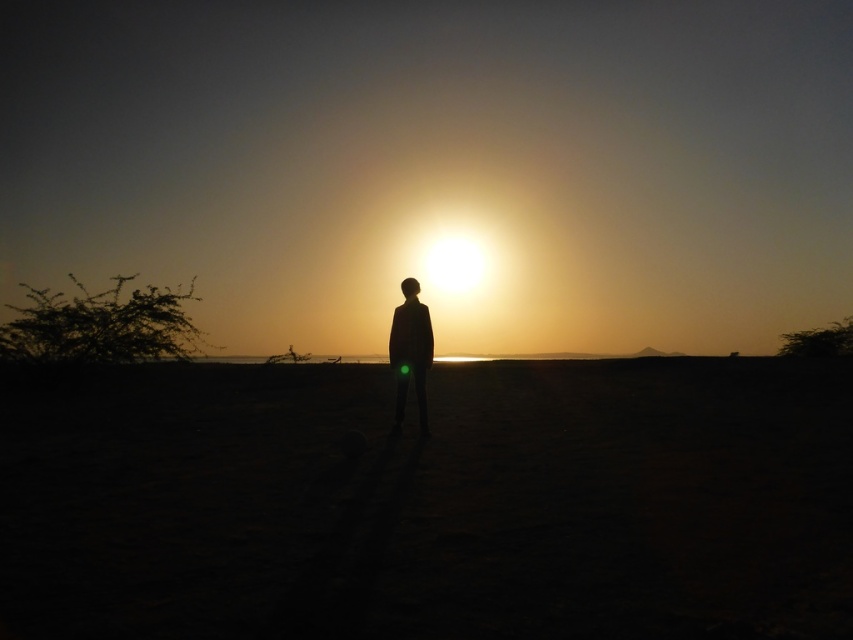
Question: Which object is closer to the camera taking this photo?

Choices:
 (A) sandy at center
 (B) silhouette figure at center

Answer: (A)

Question: Is sandy at center thinner than silhouette figure at center?

Choices:
 (A) yes
 (B) no

Answer: (B)

Question: Is sandy at center further to camera compared to silhouette figure at center?

Choices:
 (A) yes
 (B) no

Answer: (B)

Question: Can you confirm if sandy at center is wider than silhouette figure at center?

Choices:
 (A) no
 (B) yes

Answer: (B)

Question: Which point appears farthest from the camera in this image?

Choices:
 (A) (402, 374)
 (B) (90, 444)

Answer: (A)

Question: Among these objects, which one is farthest from the camera?

Choices:
 (A) sandy at center
 (B) silhouette figure at center

Answer: (B)